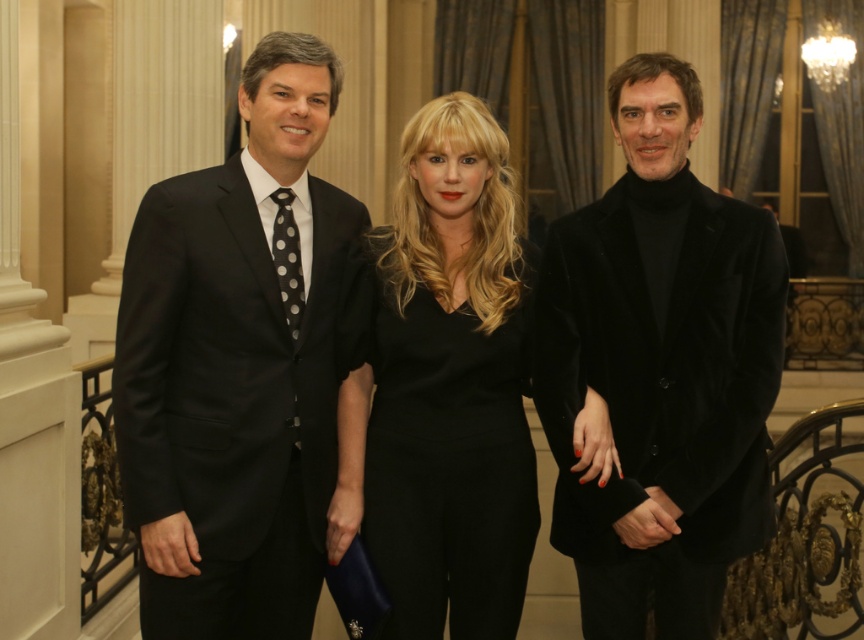
Based on the photo, you are a photographer at this event and need to adjust the lighting to ensure both the matte black suit at left and the black velvet dress at center are evenly illuminated. Given their distance apart, will you need to move the lights closer or farther away to achieve this?

The matte black suit at left and black velvet dress at center are 1.28 meters apart. To evenly illuminate both, you should move the lights closer to reduce the distance, ensuring consistent lighting across the 1.28 meter gap between them.

Looking at this image, you are a photographer setting up for a group photo. You need to position the matte black suit at left and the velvet black jacket at right so that they appear balanced in height in the final image. Given their actual heights, which adjustment should you make?

The matte black suit at left is taller than the velvet black jacket at right. To balance their heights in the photo, you should position the velvet black jacket at right closer to the camera to make it appear taller, while moving the matte black suit at left slightly farther back to reduce its apparent height.

You are attending a formal event and see two guests wearing black velvet clothing. The velvet black jacket at right and the black velvet dress at center. Which one is positioned more to the right side of the image?

The velvet black jacket at right is positioned more to the right side of the image compared to the black velvet dress at center.